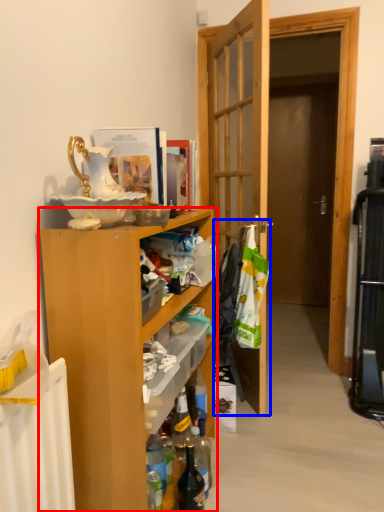
Question: Which of the following is the farthest to the observer, cabinetry (highlighted by a red box) or laundry (highlighted by a blue box)?

Choices:
 (A) cabinetry
 (B) laundry

Answer: (B)